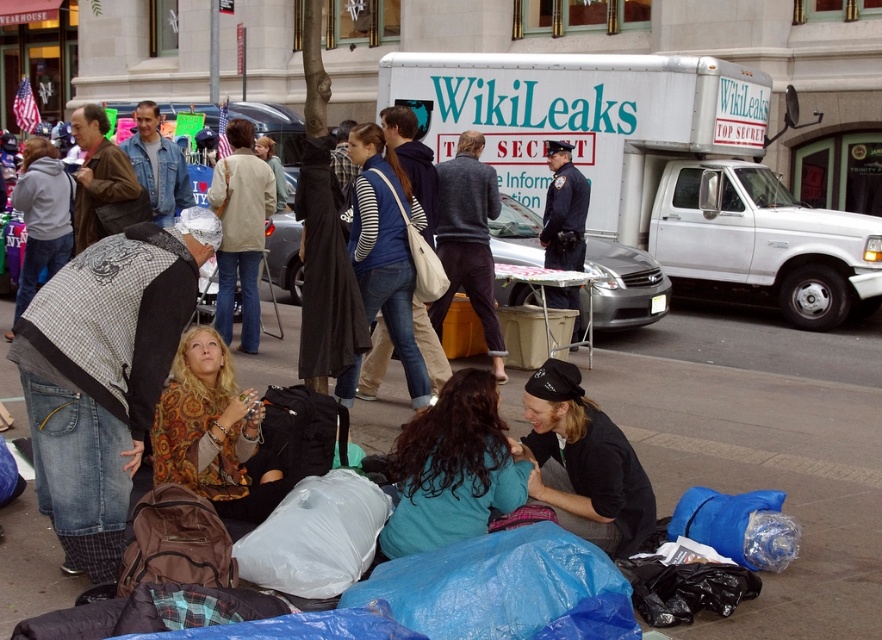
Question: Can you confirm if teal fabric jacket at center is thinner than dark gray sweater at center?

Choices:
 (A) yes
 (B) no

Answer: (B)

Question: Can you confirm if light beige jacket at center is wider than dark blue uniform at center?

Choices:
 (A) yes
 (B) no

Answer: (A)

Question: Which point is closer to the camera?

Choices:
 (A) dark gray sweater at center
 (B) teal fabric jacket at center

Answer: (B)

Question: Which point is farther to the camera?

Choices:
 (A) (644, 426)
 (B) (228, 220)
 (C) (475, 452)

Answer: (B)

Question: Does blue tarp at lower center appear on the left side of dark gray sweater at center?

Choices:
 (A) no
 (B) yes

Answer: (A)

Question: Which of these objects is positioned closest to the dark blue uniform at center?

Choices:
 (A) dark brown leather jacket at lower center
 (B) dark gray sweater at center

Answer: (B)